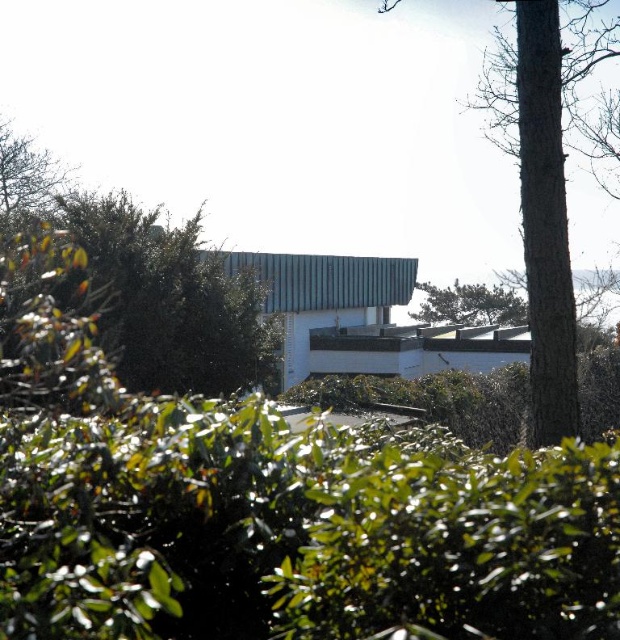
Which is more to the right, brown textured tree at center or green leafy tree at upper center?

Positioned to the right is green leafy tree at upper center.

Between brown textured tree at center and green leafy tree at upper center, which one has less height?

Standing shorter between the two is green leafy tree at upper center.

Is point (529, 99) farther from viewer compared to point (456, 300)?

No.

Where is `brown textured tree at center`? The image size is (620, 640). brown textured tree at center is located at coordinates (x=546, y=180).